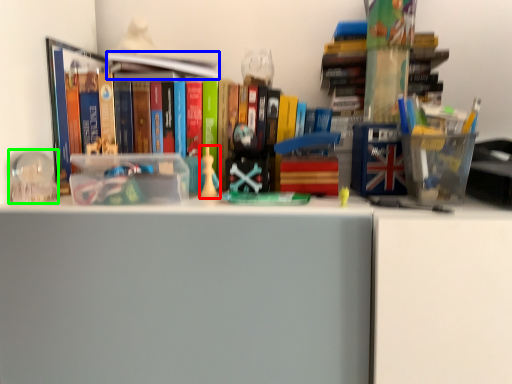
Question: Estimate the real-world distances between objects in this image. Which object is farther from toy (highlighted by a red box), book (highlighted by a blue box) or toy (highlighted by a green box)?

Choices:
 (A) book
 (B) toy

Answer: (B)